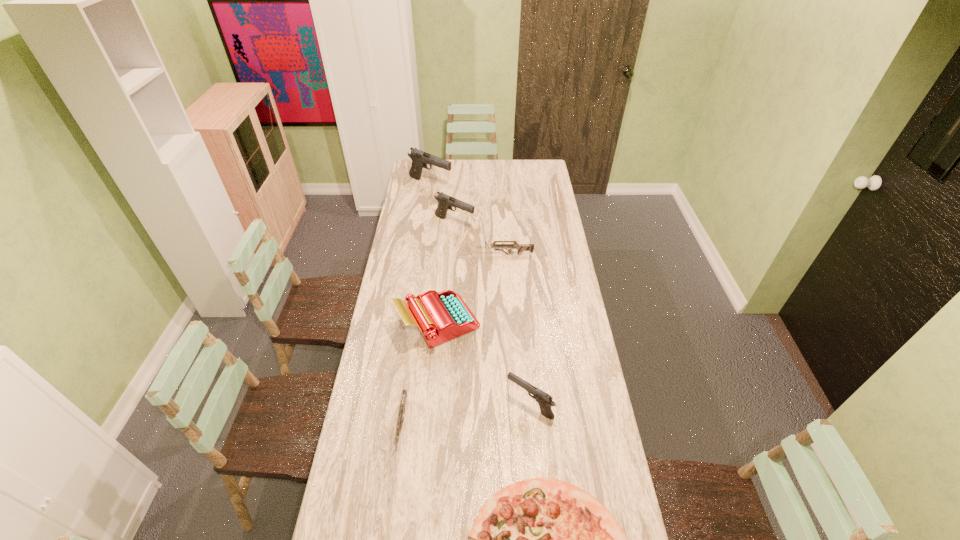
Find the location of `grey gun identified as the closest to the fourth nearest object`. grey gun identified as the closest to the fourth nearest object is located at coordinates (404, 394).